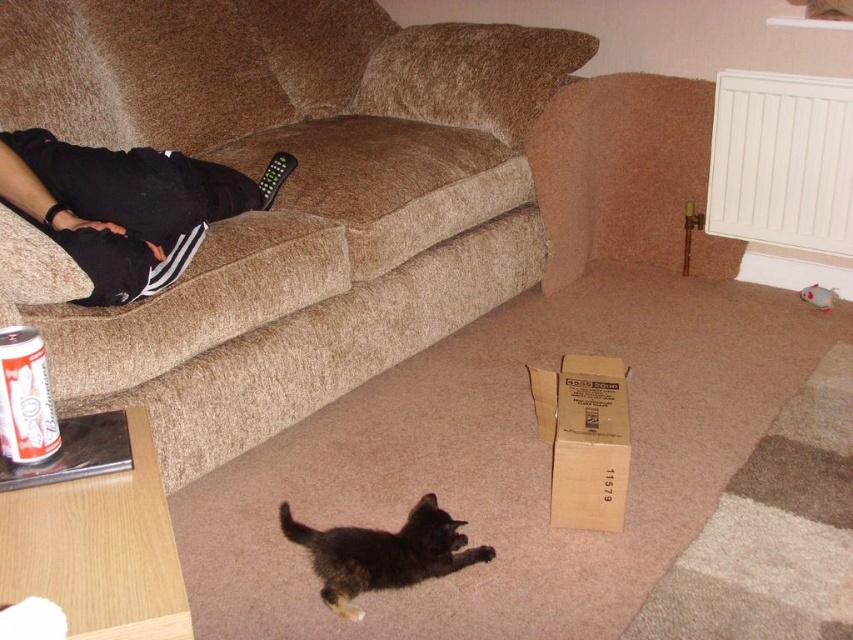
Does point (119, 301) lie in front of point (437, 545)?

That is False.

Is black cotton shirt at upper left positioned at the back of dark brown fur kitten at center?

That is True.

At what (x,y) coordinates should I click in order to perform the action: click on black cotton shirt at upper left. Please return your answer as a coordinate pair (x, y). The image size is (853, 640). Looking at the image, I should click on (120, 208).

Where is `black cotton shirt at upper left`? This screenshot has height=640, width=853. black cotton shirt at upper left is located at coordinates (120, 208).

Between point (225, 60) and point (35, 344), which one is positioned in front?

Positioned in front is point (35, 344).

Does beige fabric couch at upper center have a lesser width compared to white paper can at lower left?

Incorrect, beige fabric couch at upper center's width is not less than white paper can at lower left's.

The image size is (853, 640). What do you see at coordinates (282, 198) in the screenshot?
I see `beige fabric couch at upper center` at bounding box center [282, 198].

Locate an element on the screen. The width and height of the screenshot is (853, 640). beige fabric couch at upper center is located at coordinates (282, 198).

Based on the photo, is dark brown fur kitten at center wider than white paper can at lower left?

Yes.

The width and height of the screenshot is (853, 640). In order to click on dark brown fur kitten at center in this screenshot , I will do `click(381, 554)`.

Identify the location of dark brown fur kitten at center. Image resolution: width=853 pixels, height=640 pixels. (381, 554).